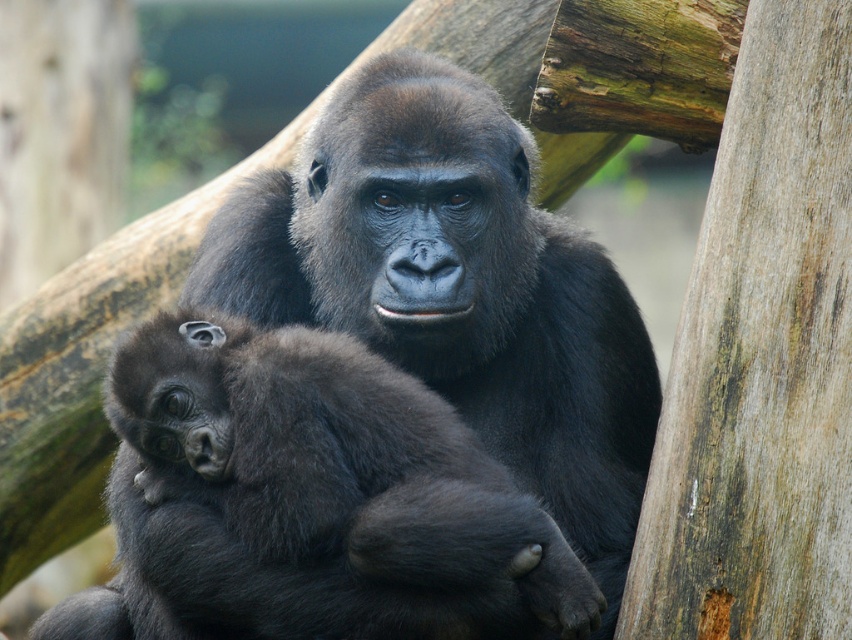
Question: Is soft fur baby gorilla at center thinner than smooth brown wood at right?

Choices:
 (A) yes
 (B) no

Answer: (B)

Question: Can you confirm if soft fur baby gorilla at center is positioned above smooth brown wood at right?

Choices:
 (A) yes
 (B) no

Answer: (B)

Question: Where is soft fur baby gorilla at center located in relation to smooth brown wood at right in the image?

Choices:
 (A) below
 (B) above

Answer: (A)

Question: Which point is closer to the camera?

Choices:
 (A) soft fur baby gorilla at center
 (B) smooth brown wood at right

Answer: (B)